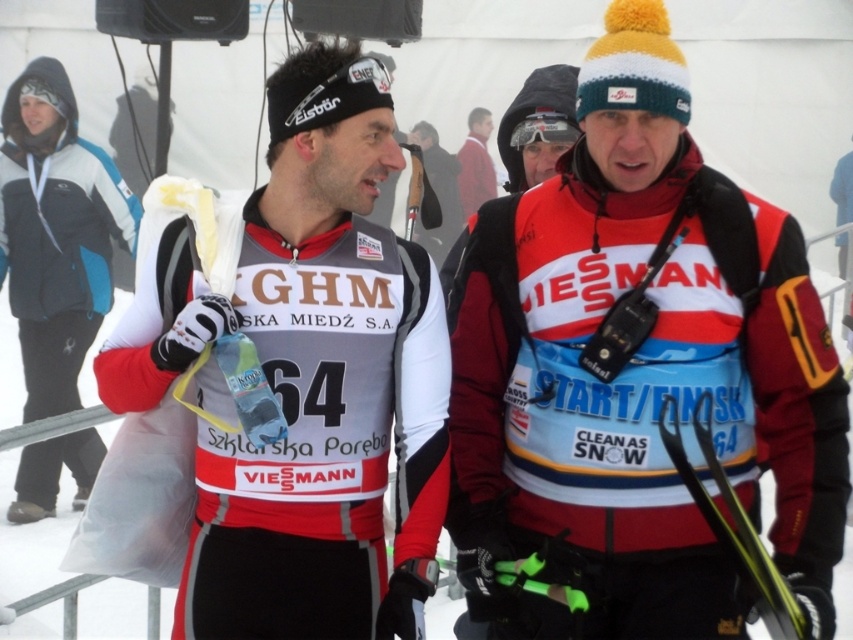
You are a photographer positioned at the starting line of a winter sports event. You need to capture a clear photo of both the matte white jersey at center and the blue synthetic jacket at left. Given their positions, which one should you focus on first to ensure both are in sharp focus?

You should focus on the matte white jersey at center first because it is closer to the viewer than the blue synthetic jacket at left. By focusing on the closer object, the depth of field may help keep both in focus.

You are a photographer at the event and want to take a picture of the red fabric jacket at center. Your camera is on a tripod 9 feet away. Can you reach the camera in time if you need to adjust the focus?

The red fabric jacket at center and camera are 9.90 feet apart, so the distance is slightly more than 9 feet. You might need to move closer or adjust the tripod to reach the camera properly.